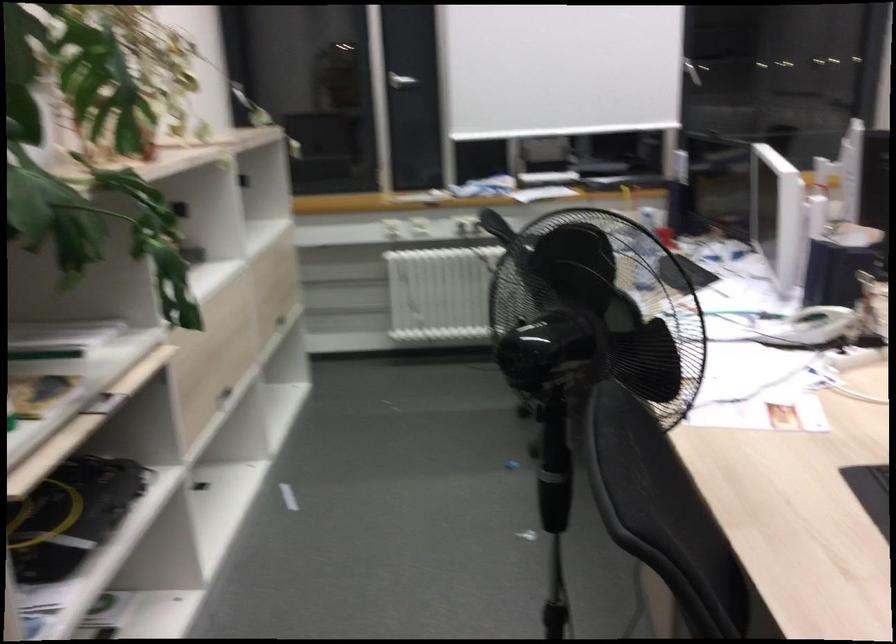
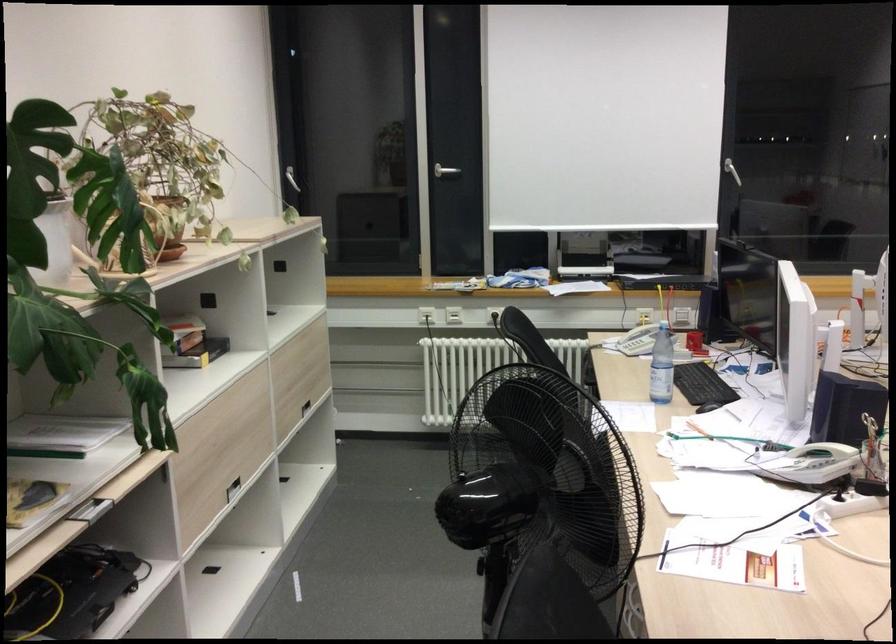
Locate, in the second image, the point that corresponds to pixel 216 339 in the first image.

(225, 435)